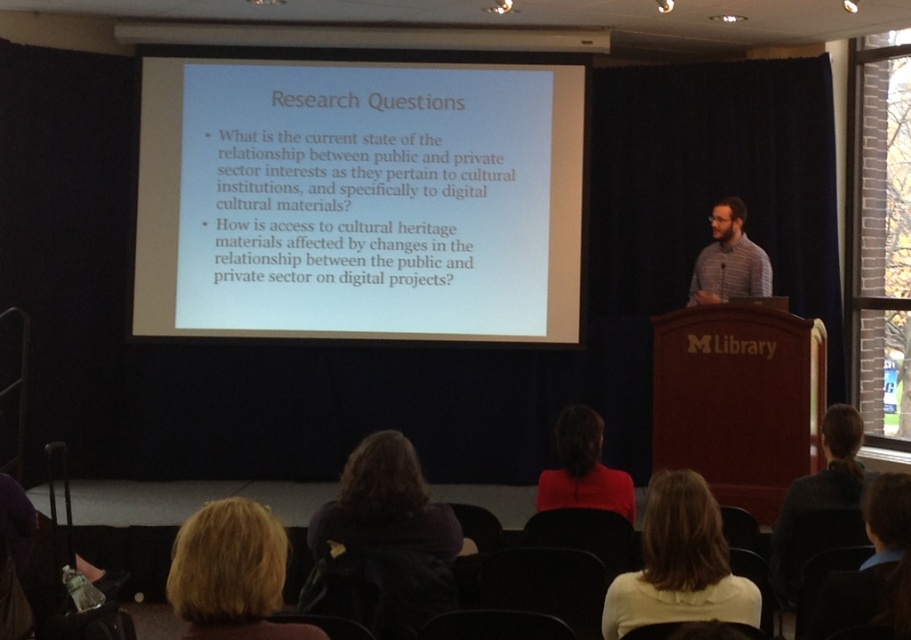
Question: Which point appears farthest from the camera in this image?

Choices:
 (A) (367, 449)
 (B) (670, 513)

Answer: (A)

Question: Can you confirm if white fabric at center is positioned below red matte shirt at center?

Choices:
 (A) no
 (B) yes

Answer: (B)

Question: Among these points, which one is farthest from the camera?

Choices:
 (A) (173, 93)
 (B) (551, 483)
 (C) (249, 513)
 (D) (694, 260)

Answer: (D)

Question: Can you confirm if blonde hair at lower left is positioned to the left of striped cotton shirt at upper right?

Choices:
 (A) yes
 (B) no

Answer: (A)

Question: Which is farther from the dark purple hoodie at lower center?

Choices:
 (A) white fabric at center
 (B) white matte projection screen at upper center

Answer: (B)

Question: Can you confirm if white matte projection screen at upper center is thinner than dark purple hoodie at lower center?

Choices:
 (A) no
 (B) yes

Answer: (A)